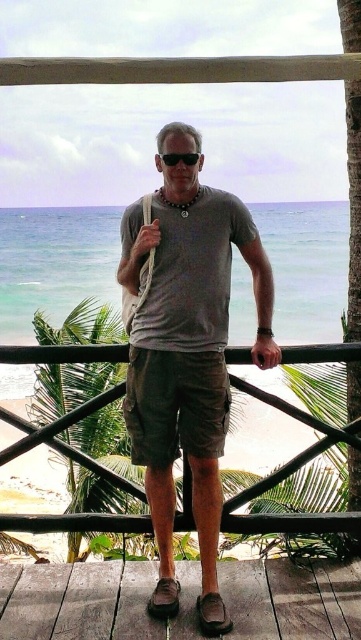
Consider the image. Does brown wooden deck at lower center have a lesser height compared to black plastic goggles at center?

No.

Which is behind, point (125, 577) or point (186, 161)?

Point (125, 577)

Who is more distant from viewer, [92,566] or [180,156]?

The point [92,566] is behind.

Locate an element on the screen. This screenshot has width=361, height=640. brown wooden deck at lower center is located at coordinates (77, 602).

Does matte gray t-shirt at center come behind black plastic goggles at center?

No.

Between matte gray t-shirt at center and black plastic goggles at center, which one is positioned lower?

matte gray t-shirt at center is lower down.

Does point (177, 276) lie behind point (189, 161)?

Yes, point (177, 276) is farther from viewer.

Find the location of a particular element. matte gray t-shirt at center is located at coordinates (186, 353).

The height and width of the screenshot is (640, 361). What do you see at coordinates (186, 353) in the screenshot? I see `matte gray t-shirt at center` at bounding box center [186, 353].

Can you confirm if matte gray t-shirt at center is wider than dark green cotton shorts at center?

Correct, the width of matte gray t-shirt at center exceeds that of dark green cotton shorts at center.

Measure the distance between matte gray t-shirt at center and camera.

matte gray t-shirt at center is 3.61 meters away from camera.

The image size is (361, 640). What are the coordinates of `matte gray t-shirt at center` in the screenshot? It's located at (186, 353).